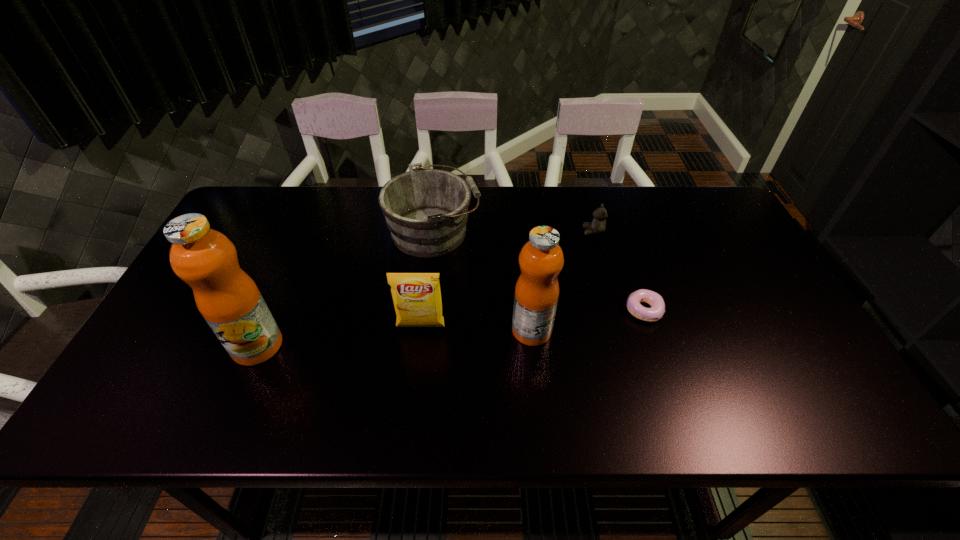
Identify the location of blank space located on the face of the teddy bear. (534, 232).

Image resolution: width=960 pixels, height=540 pixels. Find the location of `free location located on the face of the teddy bear`. free location located on the face of the teddy bear is located at coordinates (511, 232).

The height and width of the screenshot is (540, 960). In order to click on vacant space positioned 0.190m on the face of the teddy bear in this screenshot , I will do `click(521, 232)`.

Locate an element on the screen. free region located 0.070m on the right of the wine bucket is located at coordinates (504, 232).

Where is `vacant position located on the back of the shortest object`? Image resolution: width=960 pixels, height=540 pixels. vacant position located on the back of the shortest object is located at coordinates pos(609,207).

Find the location of `vacant space located 0.150m on the front of the crisp (potato chip) with the logo`. vacant space located 0.150m on the front of the crisp (potato chip) with the logo is located at coordinates (414, 388).

Where is `teddy bear present at the far edge`? teddy bear present at the far edge is located at coordinates (598, 225).

The image size is (960, 540). Identify the location of wine bucket at the far edge. (426, 210).

You are a GUI agent. You are given a task and a screenshot of the screen. Output one action in this format:
    pyautogui.click(x=<x>, y=<y>)
    Task: Click on the object present at the near edge
    
    Given the screenshot: What is the action you would take?
    pyautogui.click(x=227, y=297)

The width and height of the screenshot is (960, 540). I want to click on vacant space at the far edge of the desktop, so click(376, 198).